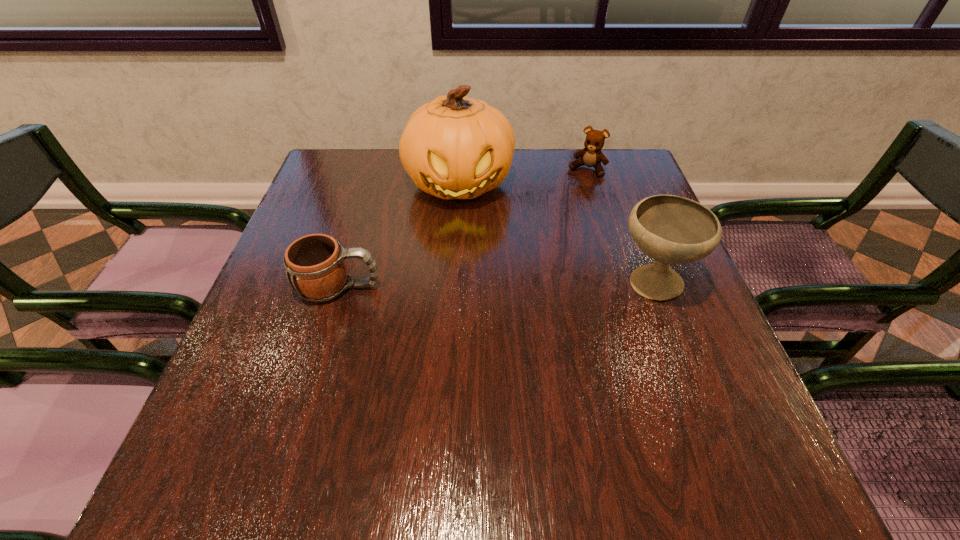
The height and width of the screenshot is (540, 960). Find the location of `vacant region located on the front face of the tallest object`. vacant region located on the front face of the tallest object is located at coordinates point(470,248).

Find the location of a particular element. This screenshot has width=960, height=540. vacant space located on the front face of the tallest object is located at coordinates pos(482,321).

The image size is (960, 540). In order to click on free space located on the front face of the tallest object in this screenshot , I will do `click(474, 272)`.

The image size is (960, 540). In order to click on teddy bear at the far edge in this screenshot , I will do `click(591, 156)`.

Find the location of a particular element. The image size is (960, 540). pumpkin positioned at the far edge is located at coordinates (454, 147).

The height and width of the screenshot is (540, 960). I want to click on object present at the left edge, so pos(316,268).

Identify the location of chalice present at the right edge. (670, 229).

Locate an element on the screen. Image resolution: width=960 pixels, height=540 pixels. teddy bear positioned at the right edge is located at coordinates (591, 156).

You are a GUI agent. You are given a task and a screenshot of the screen. Output one action in this format:
    pyautogui.click(x=<x>, y=<y>)
    Task: Click on the object positioned at the far right corner
    The image size is (960, 540).
    Given the screenshot: What is the action you would take?
    pyautogui.click(x=591, y=156)

What are the coordinates of `vacant space at the far edge` in the screenshot? It's located at (534, 181).